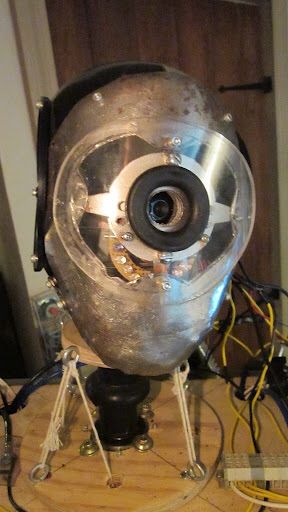
What are the coordinates of `round wooden base` in the screenshot? It's located at (169, 488).